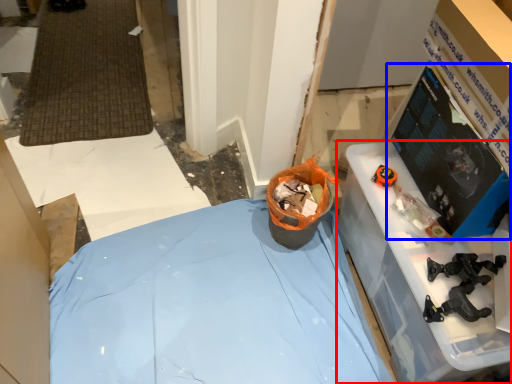
Question: Which object appears farthest to the camera in this image, furniture (highlighted by a red box) or computer monitor (highlighted by a blue box)?

Choices:
 (A) furniture
 (B) computer monitor

Answer: (A)